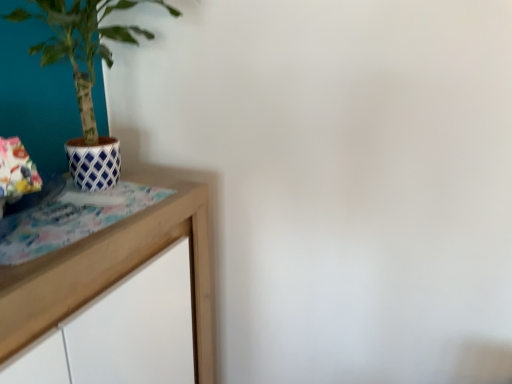
Identify the location of blue and white lattice pot at left. (82, 42).

This screenshot has width=512, height=384. What do you see at coordinates (82, 42) in the screenshot?
I see `blue and white lattice pot at left` at bounding box center [82, 42].

Describe the element at coordinates (112, 270) in the screenshot. The height and width of the screenshot is (384, 512). I see `wooden table at left` at that location.

This screenshot has height=384, width=512. I want to click on wooden table at left, so click(112, 270).

I want to click on blue and white lattice pot at left, so click(82, 42).

Which is more to the left, wooden table at left or blue and white lattice pot at left?

From the viewer's perspective, wooden table at left appears more on the left side.

Which is in front, wooden table at left or blue and white lattice pot at left?

wooden table at left is more forward.

Between point (154, 239) and point (16, 19), which one is positioned in front?

The point (154, 239) is in front.

From the image's perspective, is wooden table at left above blue and white lattice pot at left?

Incorrect, from the image's perspective, wooden table at left is lower than blue and white lattice pot at left.

From a real-world perspective, between wooden table at left and blue and white lattice pot at left, who is vertically lower?

wooden table at left is physically lower.

Does wooden table at left have a greater width compared to blue and white lattice pot at left?

Yes.

From their relative heights in the image, would you say wooden table at left is taller or shorter than blue and white lattice pot at left?

wooden table at left is taller than blue and white lattice pot at left.

Is wooden table at left bigger or smaller than blue and white lattice pot at left?

wooden table at left is bigger than blue and white lattice pot at left.

Is blue and white lattice pot at left inside wooden table at left?

Definitely not — blue and white lattice pot at left is not inside wooden table at left.

Is wooden table at left far from blue and white lattice pot at left?

They are positioned close to each other.

Is blue and white lattice pot at left at the back of wooden table at left?

No.

Image resolution: width=512 pixels, height=384 pixels. Identify the location of houseplant that is above the wooden table at left (from a real-world perspective). (82, 42).

Considering the positions of objects blue and white lattice pot at left and wooden table at left in the image provided, who is more to the left, blue and white lattice pot at left or wooden table at left?

Positioned to the left is wooden table at left.

Which object is further away from the camera taking this photo, blue and white lattice pot at left or wooden table at left?

blue and white lattice pot at left is more distant.

Is point (42, 65) positioned after point (65, 251)?

Yes, point (42, 65) is farther from viewer.

From the image's perspective, which object appears higher, blue and white lattice pot at left or wooden table at left?

blue and white lattice pot at left.

From a real-world perspective, is blue and white lattice pot at left on top of wooden table at left?

Yes, from a real-world perspective, blue and white lattice pot at left is on top of wooden table at left.

Does blue and white lattice pot at left have a greater width compared to wooden table at left?

No, blue and white lattice pot at left is not wider than wooden table at left.

Who is shorter, blue and white lattice pot at left or wooden table at left?

With less height is blue and white lattice pot at left.

Considering the sizes of blue and white lattice pot at left and wooden table at left in the image, is blue and white lattice pot at left bigger or smaller than wooden table at left?

Considering their sizes, blue and white lattice pot at left takes up less space than wooden table at left.

Is blue and white lattice pot at left positioned beyond the bounds of wooden table at left?

Yes, blue and white lattice pot at left is located beyond the bounds of wooden table at left.

Is the surface of blue and white lattice pot at left in direct contact with wooden table at left?

blue and white lattice pot at left and wooden table at left are not in contact.

Is blue and white lattice pot at left aimed at wooden table at left?

No, blue and white lattice pot at left does not turn towards wooden table at left.

The height and width of the screenshot is (384, 512). In the image, there is a wooden table at left. Identify the location of houseplant above it (from the image's perspective). (82, 42).

Identify the location of table below the blue and white lattice pot at left (from a real-world perspective). (112, 270).

I want to click on houseplant that appears above the wooden table at left (from the image's perspective), so click(82, 42).